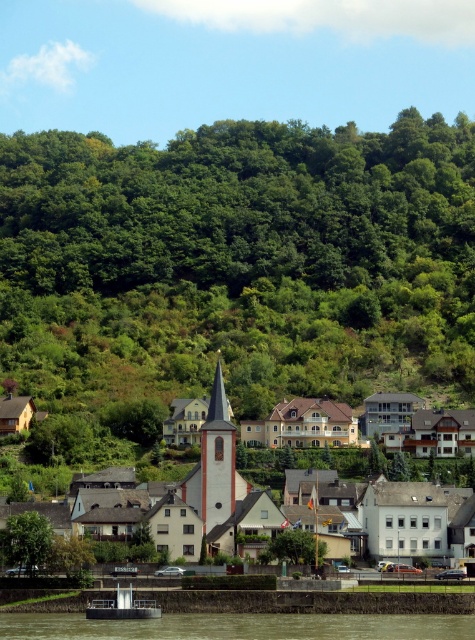
Is white stucco church at center smaller than white plastic boat at lower left?

Incorrect, white stucco church at center is not smaller in size than white plastic boat at lower left.

What do you see at coordinates (387, 515) in the screenshot? I see `white stucco church at center` at bounding box center [387, 515].

Between point (388, 540) and point (100, 609), which one is positioned in front?

Point (100, 609)

The image size is (475, 640). Find the location of `white stucco church at center`. white stucco church at center is located at coordinates (387, 515).

Is point (142, 200) positioned before point (34, 564)?

No, it is not.

Between point (124, 180) and point (22, 515), which one is positioned in front?

Point (22, 515) is more forward.

The height and width of the screenshot is (640, 475). I want to click on green leafy hillside at upper center, so click(x=247, y=252).

Which of these two, green leafy hillside at upper center or white plastic boat at lower left, stands shorter?

white plastic boat at lower left

Is green leafy hillside at upper center closer to camera compared to white plastic boat at lower left?

No, it is behind white plastic boat at lower left.

Between point (93, 284) and point (110, 608), which one is positioned behind?

The point (93, 284) is more distant.

At what (x,y) coordinates should I click in order to perform the action: click on green leafy hillside at upper center. Please return your answer as a coordinate pair (x, y). Looking at the image, I should click on (247, 252).